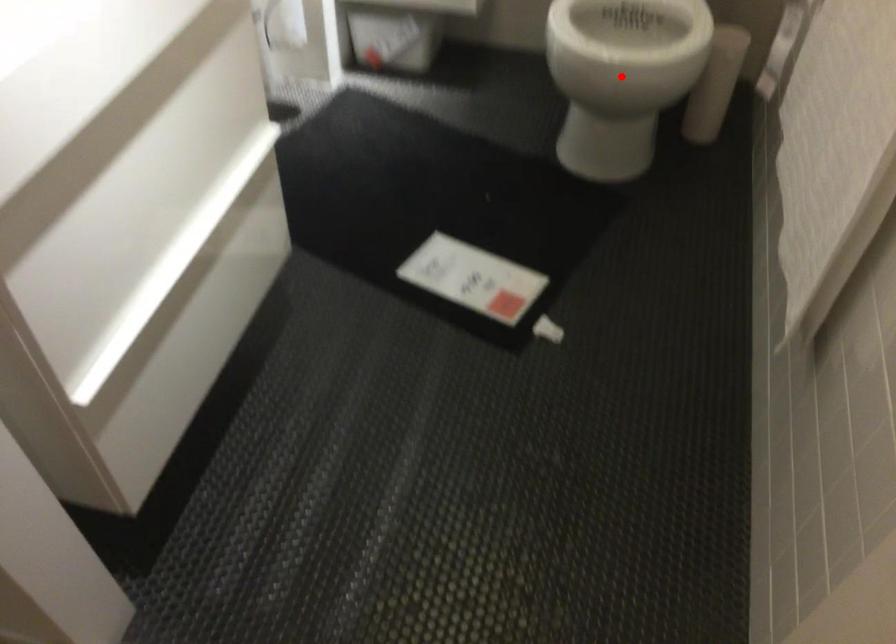
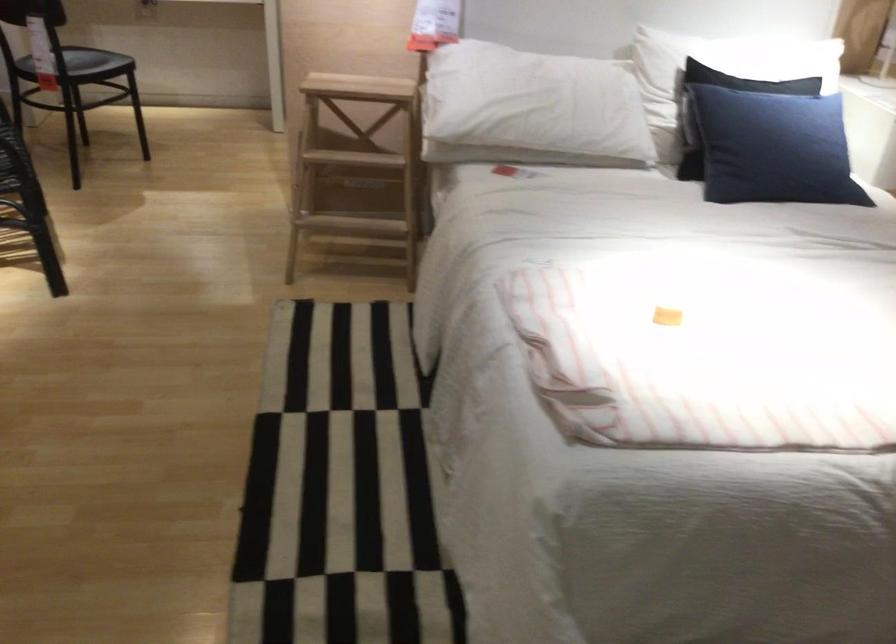
Question: I am providing you with two images of the same scene from different viewpoints. A red point is marked on the first image. Is the red point's position out of view in image 2?

Choices:
 (A) Yes
 (B) No

Answer: (A)